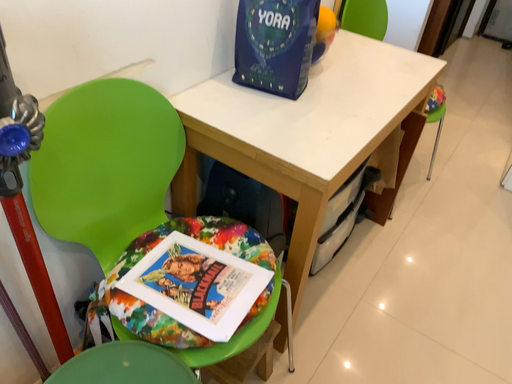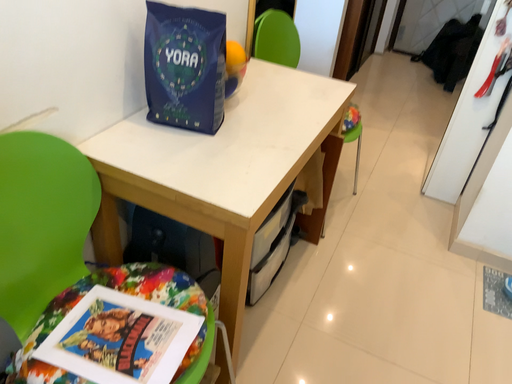
Question: Which way did the camera rotate in the video?

Choices:
 (A) rotated right
 (B) rotated left

Answer: (A)